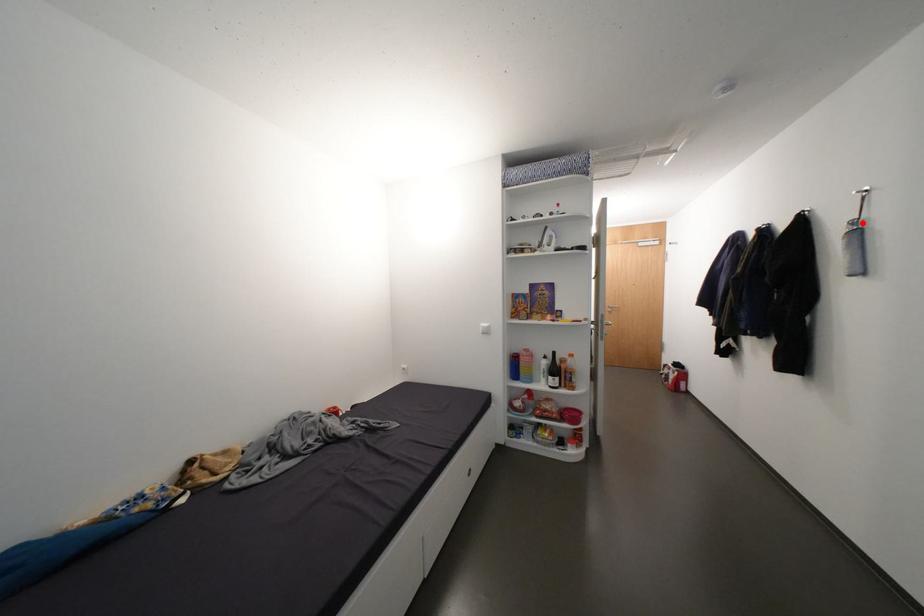
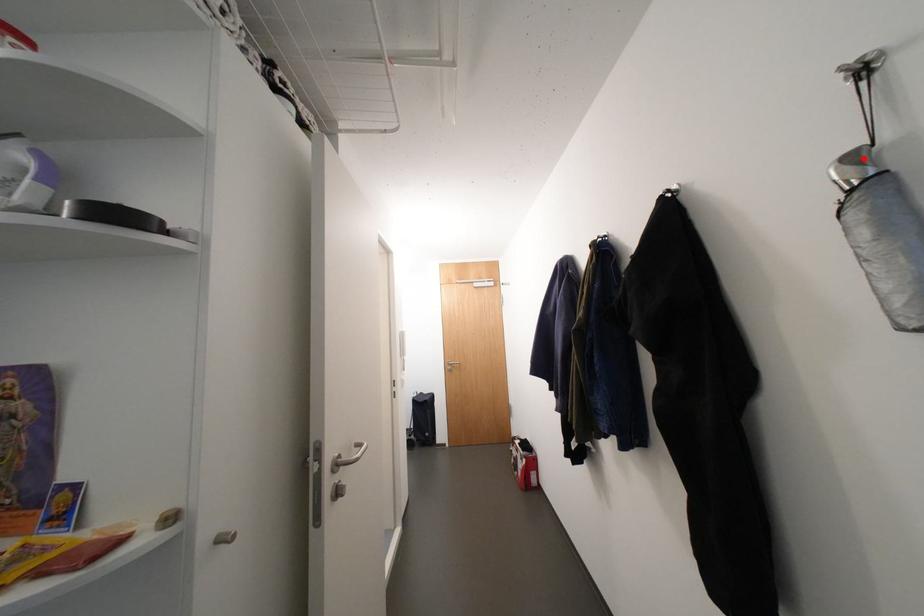
I am providing you with two images of the same scene from different viewpoints. A red point is marked on the first image and another point is marked on the second image. Are the points marked in image1 and image2 representing the same 3D position?

Yes